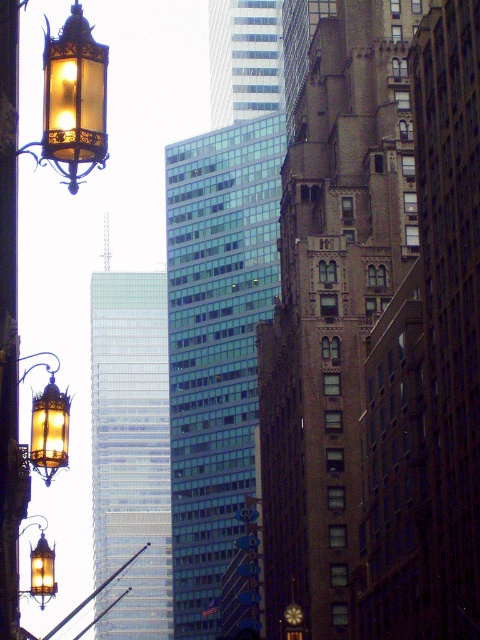
Is matte glass lantern at upper left positioned in front of matte brass lantern at upper left?

Yes, matte glass lantern at upper left is closer to the viewer.

Is matte glass lantern at upper left above matte brass lantern at upper left?

Yes, matte glass lantern at upper left is above matte brass lantern at upper left.

Identify the location of matte glass lantern at upper left. This screenshot has height=640, width=480. (73, 100).

Who is more forward, (31, 572) or (72, 67)?

Point (72, 67)

Does matte brass lantern at left appear on the right side of matte glass lantern at left?

Incorrect, matte brass lantern at left is not on the right side of matte glass lantern at left.

Where is `matte brass lantern at left`? The width and height of the screenshot is (480, 640). matte brass lantern at left is located at coordinates (40, 564).

Consider the image. Who is positioned more to the left, matte brass lantern at upper left or matte brass lantern at left?

matte brass lantern at upper left is more to the left.

Is point (62, 445) farther from camera compared to point (40, 572)?

That is False.

Image resolution: width=480 pixels, height=640 pixels. What are the coordinates of `matte brass lantern at upper left` in the screenshot? It's located at (48, 422).